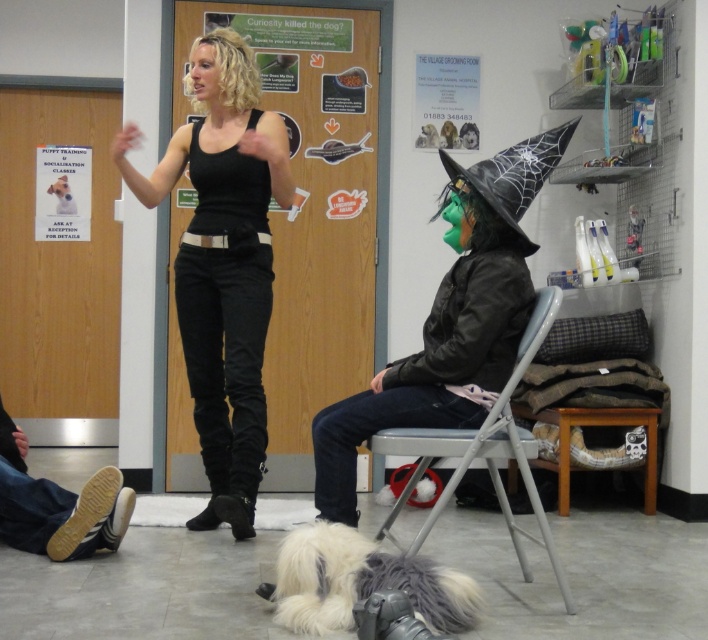
You are a customer in a costume shop and see the black leather witch hat at upper right and the brown wooden stool at lower center. Which object is shorter?

The black leather witch hat at upper right is shorter than the brown wooden stool at lower center.

From the picture: You are a delivery person who needs to place a package between the black leather witch hat at upper right and the brown wooden stool at lower center. The package requires 1.5 meters of space. Is there enough space?

The black leather witch hat at upper right is 1.75 meters from the brown wooden stool at lower center, so yes, there is enough space to place the package between them since 1.75 meters is more than the required 1.5 meters.